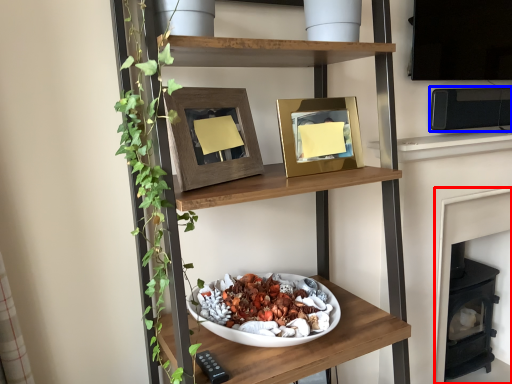
Question: Which of the following is the closest to the observer, fireplace (highlighted by a red box) or appliance (highlighted by a blue box)?

Choices:
 (A) fireplace
 (B) appliance

Answer: (B)